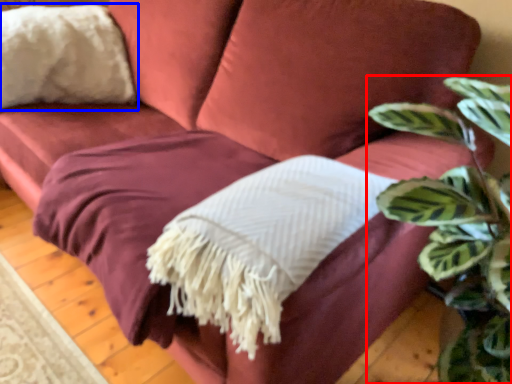
Question: Which point is closer to the camera, houseplant (highlighted by a red box) or throw pillow (highlighted by a blue box)?

Choices:
 (A) houseplant
 (B) throw pillow

Answer: (A)